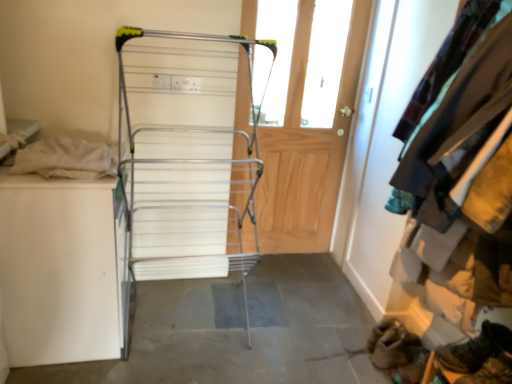
The height and width of the screenshot is (384, 512). I want to click on free space underneath silver metallic drying rack at center (from a real-world perspective), so click(x=187, y=324).